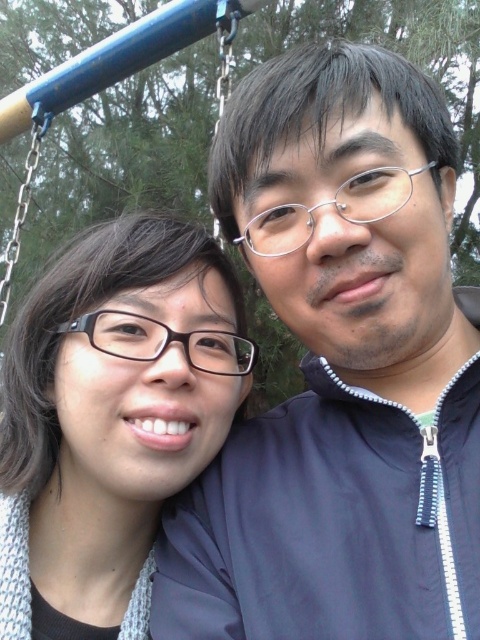
You are standing in front of the image and want to locate the matte blue jacket at upper right. According to the coordinates provided, where exactly is it positioned?

The matte blue jacket at upper right is located at point coordinates 0.581 in the x axis and 0.708 in the y axis.

You are a photographer trying to capture both the matte blue jacket at upper right and the matte black glasses at left in a single frame. Which object should you focus on first to ensure both are in the frame?

The matte blue jacket at upper right is bigger than the matte black glasses at left, so you should focus on the matte blue jacket at upper right first to ensure both are in the frame.

You are standing 40 inches away from the point marked at coordinates (387, 314) in the image. Can you comfortably reach that point without moving your feet?

The distance of point (387, 314) from viewer is 37.07 inches. Since you are standing 40 inches away, you are slightly farther than the point, so you can comfortably reach it without moving your feet.